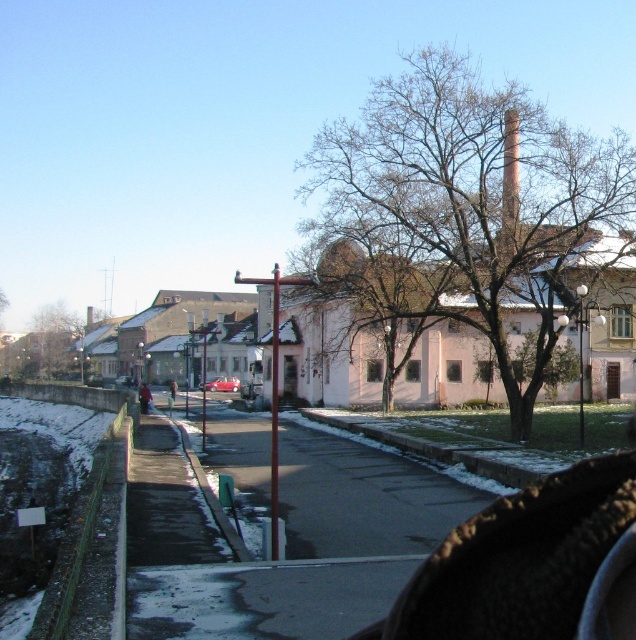
Question: Does smooth gray chimney at upper right appear on the left side of shiny red car at center?

Choices:
 (A) no
 (B) yes

Answer: (A)

Question: Is bare branches at center thinner than smooth gray chimney at upper right?

Choices:
 (A) yes
 (B) no

Answer: (B)

Question: Estimate the real-world distances between objects in this image. Which object is farther from the brown leafless tree at left?

Choices:
 (A) smooth gray chimney at upper right
 (B) shiny red car at center

Answer: (A)

Question: Among these points, which one is farthest from the camera?

Choices:
 (A) (506, 248)
 (B) (43, 368)
 (C) (508, 154)

Answer: (B)

Question: Which of the following is the closest to the observer?

Choices:
 (A) smooth gray chimney at upper right
 (B) brown leafless tree at left
 (C) shiny red car at center
 (D) bare branches at center

Answer: (D)

Question: Considering the relative positions of bare branches at center and shiny red car at center in the image provided, where is bare branches at center located with respect to shiny red car at center?

Choices:
 (A) left
 (B) right

Answer: (B)